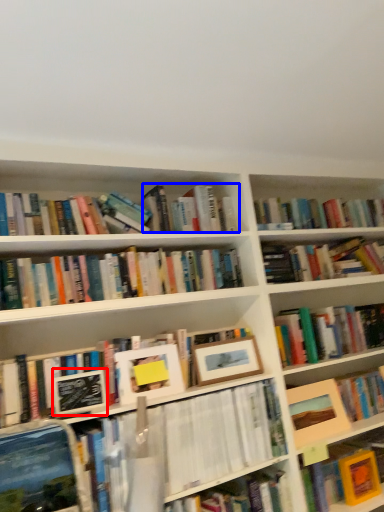
Question: Which of the following is the farthest to the observer, paperback book (highlighted by a red box) or book (highlighted by a blue box)?

Choices:
 (A) paperback book
 (B) book

Answer: (B)